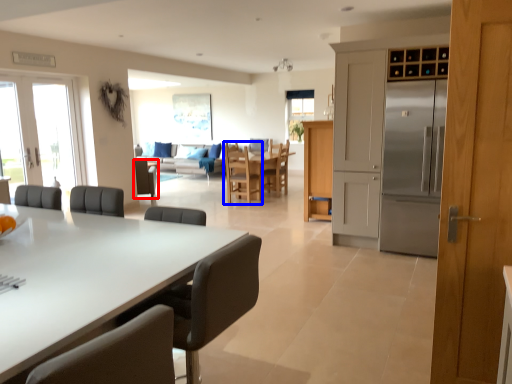
Question: Which object appears closest to the camera in this image, chair (highlighted by a red box) or chair (highlighted by a blue box)?

Choices:
 (A) chair
 (B) chair

Answer: (B)